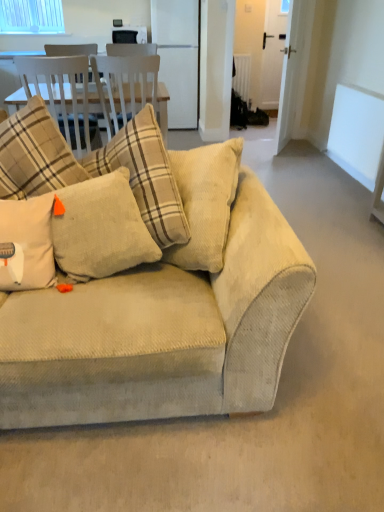
Where is `free space in front of beige corduroy couch at center`? The width and height of the screenshot is (384, 512). free space in front of beige corduroy couch at center is located at coordinates (186, 455).